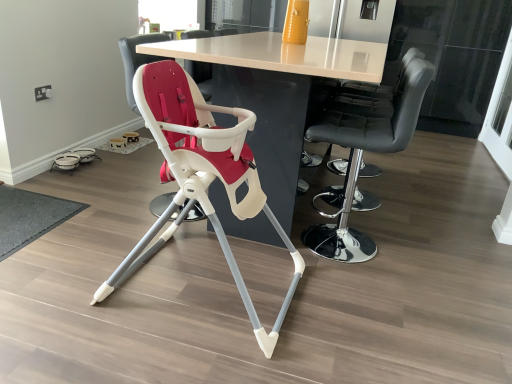
Question: From a real-world perspective, is black leather bar stool at right, positioned as the first chair in right-to-left order, located beneath white plastic highchair at center, the 1th chair when ordered from left to right?

Choices:
 (A) no
 (B) yes

Answer: (A)

Question: Is black leather bar stool at right, marked as the third chair in a left-to-right arrangement, facing towards white plastic highchair at center, the 1th chair when ordered from left to right?

Choices:
 (A) yes
 (B) no

Answer: (A)

Question: Is black leather bar stool at right, marked as the third chair in a left-to-right arrangement, taller than white plastic highchair at center, the 1th chair when ordered from left to right?

Choices:
 (A) yes
 (B) no

Answer: (A)

Question: Is black leather bar stool at right, marked as the third chair in a left-to-right arrangement, closer to the viewer compared to white plastic highchair at center, arranged as the 3th chair when viewed from the right?

Choices:
 (A) no
 (B) yes

Answer: (B)

Question: Is the depth of black leather bar stool at right, marked as the third chair in a left-to-right arrangement, greater than that of white plastic highchair at center, the 1th chair when ordered from left to right?

Choices:
 (A) no
 (B) yes

Answer: (A)

Question: Is black leather bar stool at right, positioned as the first chair in right-to-left order, placed right next to white plastic highchair at center, the 1th chair when ordered from left to right?

Choices:
 (A) no
 (B) yes

Answer: (A)

Question: From the image's perspective, does transparent glass screen door at upper right appear higher than black leather bar stool at right, marked as the third chair in a left-to-right arrangement?

Choices:
 (A) no
 (B) yes

Answer: (B)

Question: Is transparent glass screen door at upper right at the left side of black leather bar stool at right, positioned as the first chair in right-to-left order?

Choices:
 (A) yes
 (B) no

Answer: (B)

Question: Is transparent glass screen door at upper right at the right side of black leather bar stool at right, positioned as the first chair in right-to-left order?

Choices:
 (A) yes
 (B) no

Answer: (A)

Question: Is transparent glass screen door at upper right smaller than black leather bar stool at right, positioned as the first chair in right-to-left order?

Choices:
 (A) yes
 (B) no

Answer: (A)

Question: Is transparent glass screen door at upper right behind black leather bar stool at right, marked as the third chair in a left-to-right arrangement?

Choices:
 (A) yes
 (B) no

Answer: (A)

Question: Does transparent glass screen door at upper right have a greater height compared to black leather bar stool at right, marked as the third chair in a left-to-right arrangement?

Choices:
 (A) yes
 (B) no

Answer: (A)

Question: Is matte plastic highchair at center, positioned as the 2th chair in right-to-left order, further to the viewer compared to white plastic highchair at center, the 1th chair when ordered from left to right?

Choices:
 (A) no
 (B) yes

Answer: (A)